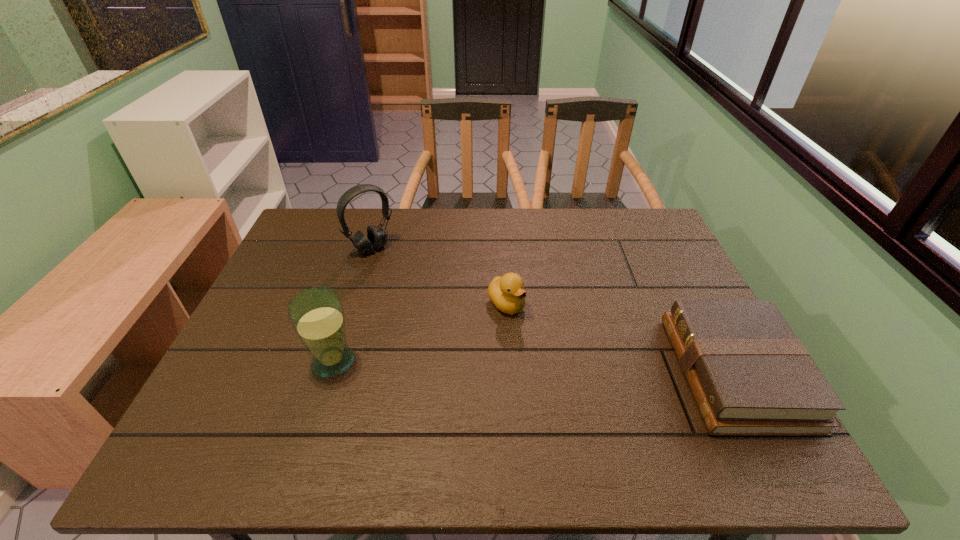
You are a GUI agent. You are given a task and a screenshot of the screen. Output one action in this format:
    pyautogui.click(x=<x>, y=<y>)
    Task: Click on the vacant spot on the desktop that is between the glass and the rightmost object and is positioned on the front-facing side of the farthest object
    The image size is (960, 540).
    Given the screenshot: What is the action you would take?
    pyautogui.click(x=489, y=366)

Image resolution: width=960 pixels, height=540 pixels. Find the location of `vacant space on the desktop that is between the glass and the Bible and is positioned on the face of the duckling`. vacant space on the desktop that is between the glass and the Bible and is positioned on the face of the duckling is located at coordinates (571, 368).